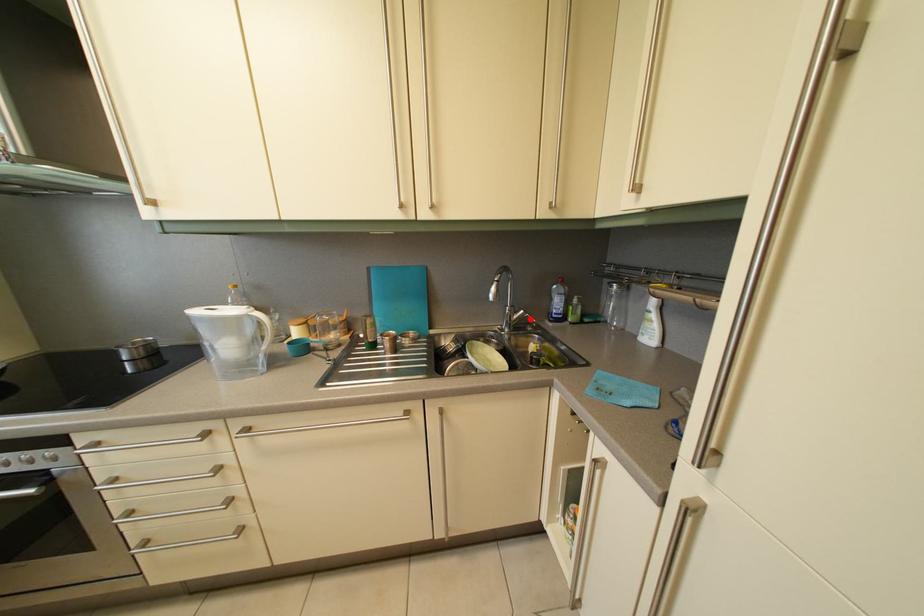
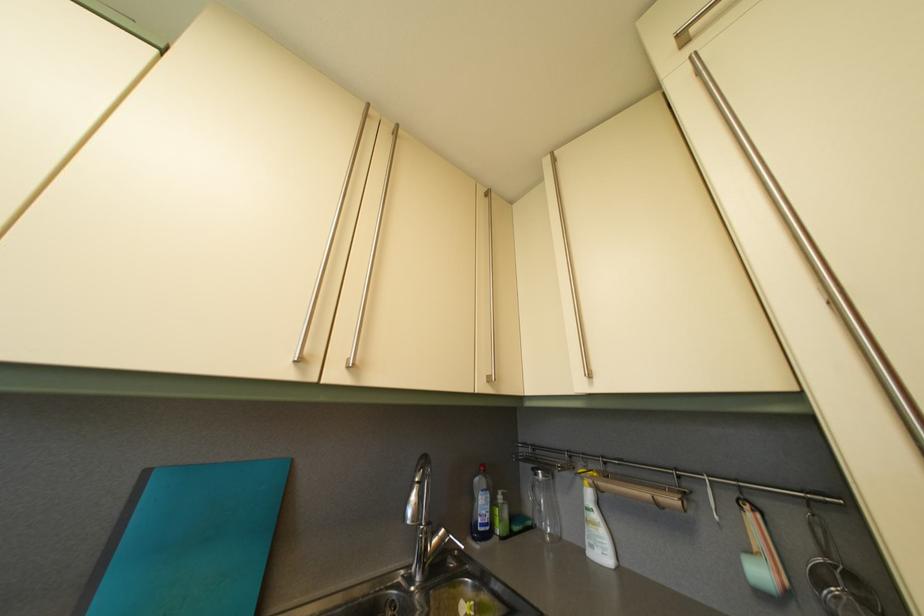
Find the pixel in the second image that matches the highlighted location in the first image.

(451, 539)